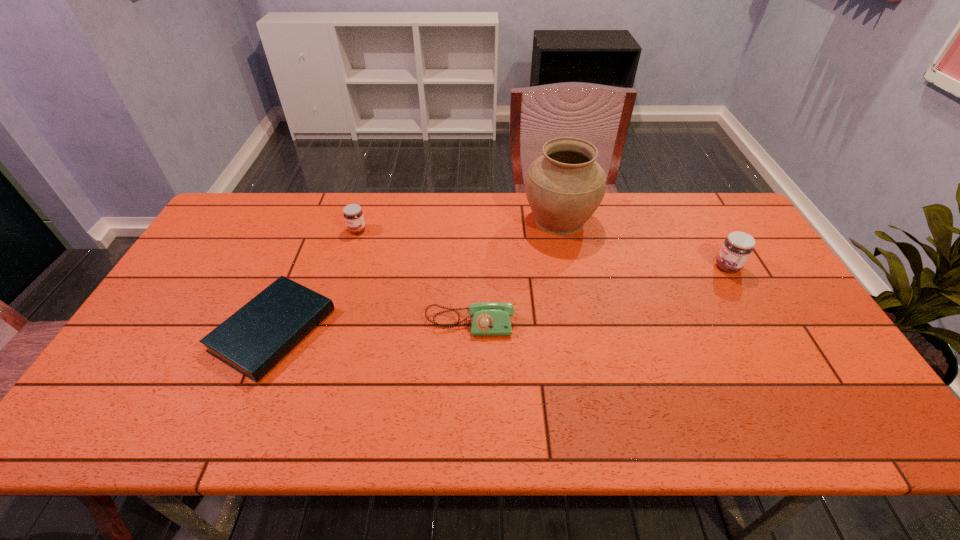
I want to click on free location at the near edge of the desktop, so click(x=554, y=409).

The height and width of the screenshot is (540, 960). I want to click on vacant space at the left edge, so 183,318.

Locate an element on the screen. vacant space at the far left corner of the desktop is located at coordinates (250, 206).

Identify the location of empty location between the taller jam and the shorter jam. This screenshot has height=540, width=960. (542, 248).

Where is `empty space that is in between the tallest object and the second shortest object`? The height and width of the screenshot is (540, 960). empty space that is in between the tallest object and the second shortest object is located at coordinates (515, 272).

You are a GUI agent. You are given a task and a screenshot of the screen. Output one action in this format:
    pyautogui.click(x=<x>, y=<y>)
    Task: Click on the empty space between the third tallest object and the tallest object
    The height and width of the screenshot is (540, 960).
    Given the screenshot: What is the action you would take?
    pyautogui.click(x=458, y=225)

At what (x,y) coordinates should I click in order to perform the action: click on empty space that is in between the tallest object and the rightmost object. Please return your answer as a coordinate pair (x, y). The width and height of the screenshot is (960, 540). Looking at the image, I should click on (643, 244).

Identify the location of empty location between the left jam and the telephone. (414, 276).

Find the location of a particular element. free space between the third shortest object and the third object from right to left is located at coordinates (414, 276).

Identify the location of free area in between the fourth tallest object and the fourth object from left to right. (515, 272).